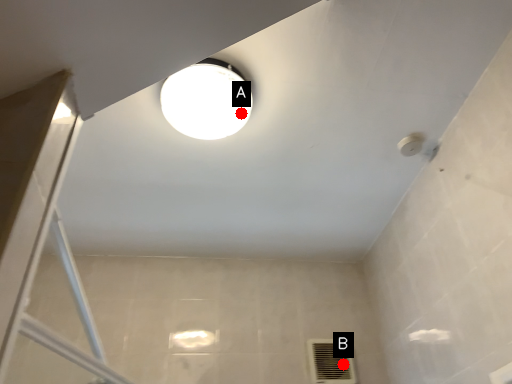
Question: Two points are circled on the image, labeled by A and B beside each circle. Among these points, which one is nearest to the camera?

Choices:
 (A) A is closer
 (B) B is closer

Answer: (A)